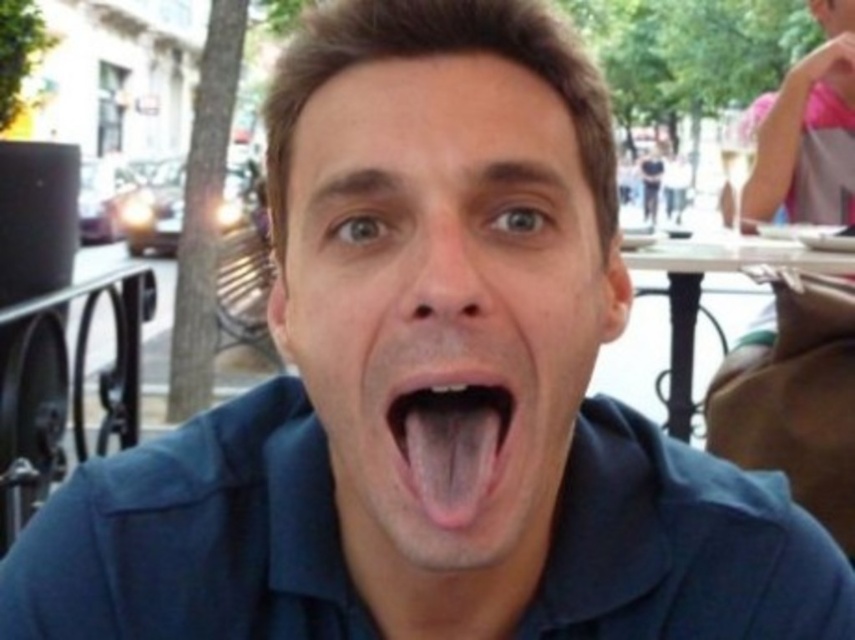
Can you confirm if pink flesh-colored tongue at center is bigger than white plastic table at center?

No, pink flesh-colored tongue at center is not bigger than white plastic table at center.

Is point (458, 524) in front of point (694, 275)?

Yes.

This screenshot has width=855, height=640. Identify the location of pink flesh-colored tongue at center. (449, 442).

Which of these two, matte blue face at center or pink flesh-colored tongue at center, stands shorter?

pink flesh-colored tongue at center is shorter.

Which is above, matte blue face at center or pink flesh-colored tongue at center?

Positioned higher is matte blue face at center.

This screenshot has height=640, width=855. I want to click on matte blue face at center, so click(443, 308).

Is point (463, 236) more distant than point (803, 268)?

That is False.

You are a GUI agent. You are given a task and a screenshot of the screen. Output one action in this format:
    pyautogui.click(x=<x>, y=<y>)
    Task: Click on the matte blue face at center
    Image resolution: width=855 pixels, height=640 pixels.
    Given the screenshot: What is the action you would take?
    pyautogui.click(x=443, y=308)